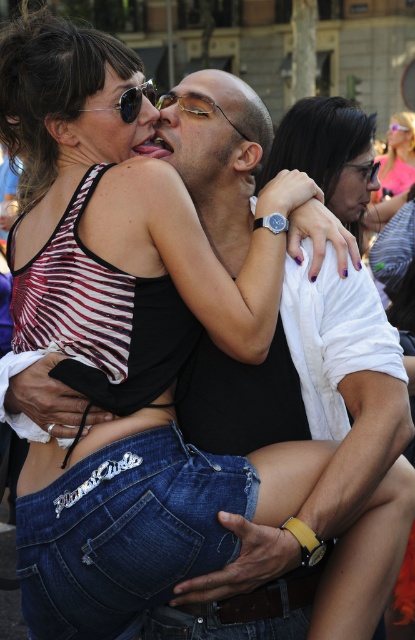
You are a photographer trying to capture a clear shot of both the matte black glasses at upper center and the matte black sunglasses at upper center in the scene. Since they are both at upper center, which one is positioned higher?

The matte black glasses at upper center is taller than the matte black sunglasses at upper center, so it is positioned higher.

You are a photographer trying to capture the perfect shot of the matte black glasses at upper center. Based on the coordinates provided, where should you position your camera to ensure the glasses are centered in the frame?

The matte black glasses at upper center are located at coordinates point (x=353, y=188), so positioning the camera to center the frame at those coordinates will ensure the glasses are centered.